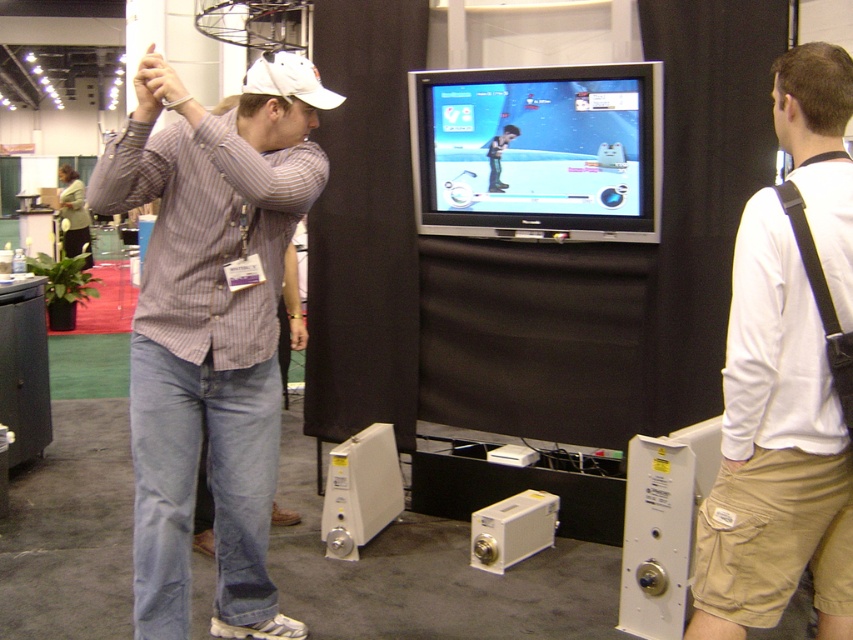
Consider the image. Does striped cotton shirt at center have a greater width compared to white cotton shirt at center?

Indeed, striped cotton shirt at center has a greater width compared to white cotton shirt at center.

Between striped cotton shirt at center and white cotton shirt at center, which one has less height?

white cotton shirt at center

Between point (169, 577) and point (775, 381), which one is positioned behind?

The point (169, 577) is more distant.

Where is `striped cotton shirt at center`? Image resolution: width=853 pixels, height=640 pixels. striped cotton shirt at center is located at coordinates (212, 326).